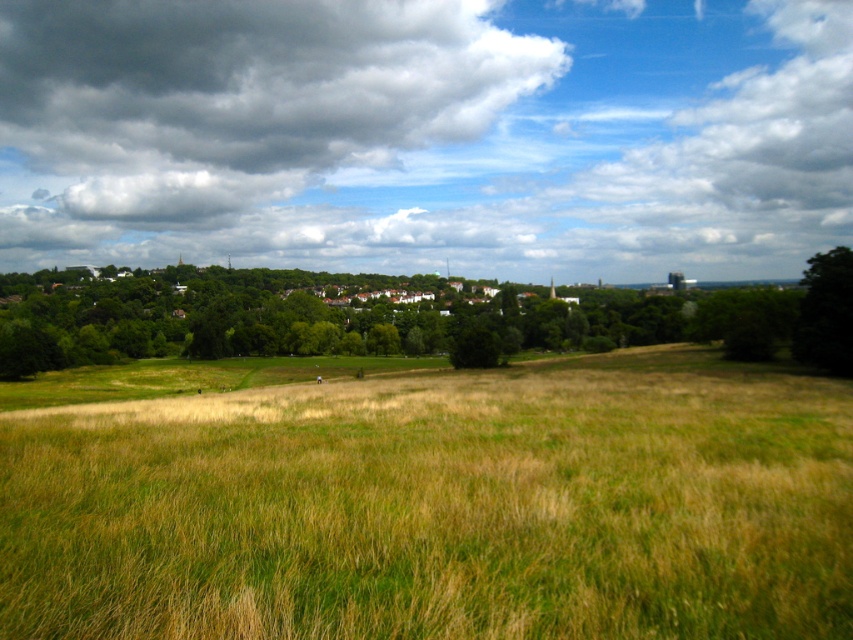
You are planning to fly a kite in this open field. The kite requires a clear space between the dark gray fluffy cloud at upper center and the green leafy tree at right to ensure it doesn not get tangled. Can the space between them accommodate the kite?

The dark gray fluffy cloud at upper center is larger than the green leafy tree at right, but since the cloud is in the sky and the tree is on the ground, the space between them is sufficient for flying the kite without tangling.